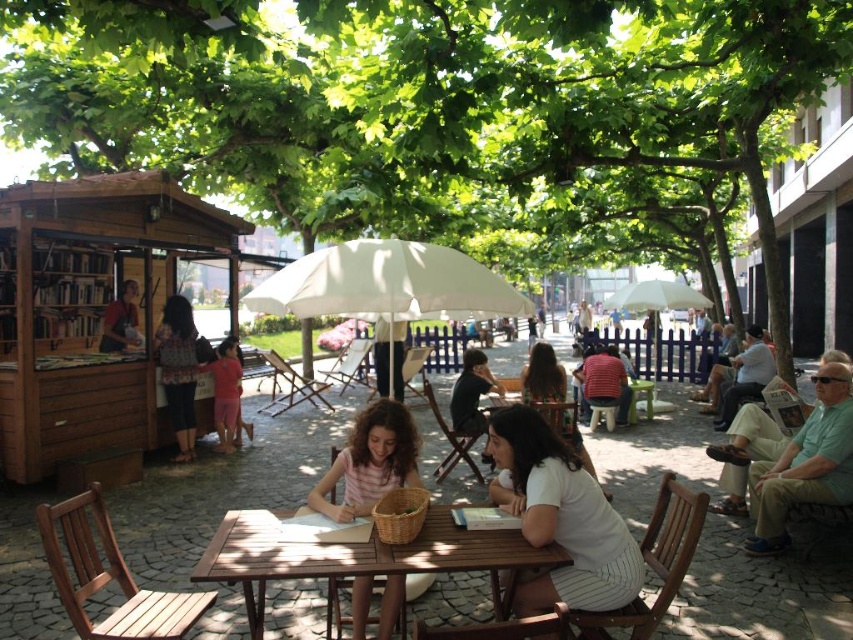
Is white cotton shirt at center above brown wooden table at center?

Indeed, white cotton shirt at center is positioned over brown wooden table at center.

Between point (585, 481) and point (490, 548), which one is positioned behind?

The point (585, 481) is behind.

I want to click on white cotton shirt at center, so click(560, 516).

Locate an element on the screen. This screenshot has width=853, height=640. white cotton shirt at center is located at coordinates (560, 516).

Is patterned fabric blouse at left shorter than white fabric umbrella at center?

No.

Can you confirm if patterned fabric blouse at left is positioned below white fabric umbrella at center?

Indeed, patterned fabric blouse at left is positioned under white fabric umbrella at center.

Between point (190, 380) and point (663, 308), which one is positioned behind?

Positioned behind is point (663, 308).

You are a GUI agent. You are given a task and a screenshot of the screen. Output one action in this format:
    pyautogui.click(x=<x>, y=<y>)
    Task: Click on the patterned fabric blouse at left
    
    Given the screenshot: What is the action you would take?
    pyautogui.click(x=178, y=371)

Describe the element at coordinates (560, 516) in the screenshot. The image size is (853, 640). I see `white cotton shirt at center` at that location.

Does white cotton shirt at center lie in front of pink fabric dress at center?

Yes, it is.

You are a GUI agent. You are given a task and a screenshot of the screen. Output one action in this format:
    pyautogui.click(x=<x>, y=<y>)
    Task: Click on the white cotton shirt at center
    Image resolution: width=853 pixels, height=640 pixels.
    Given the screenshot: What is the action you would take?
    pyautogui.click(x=560, y=516)